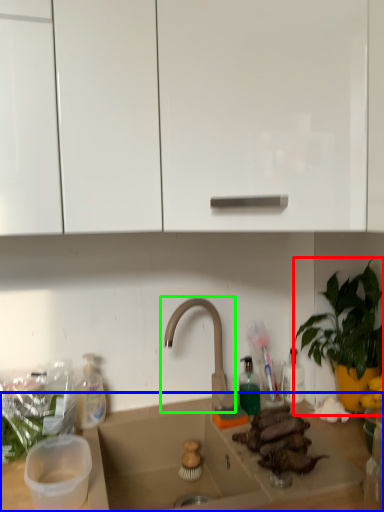
Question: Considering the real-world distances, which object is closest to houseplant (highlighted by a red box)? countertop (highlighted by a blue box) or tap (highlighted by a green box).

Choices:
 (A) countertop
 (B) tap

Answer: (B)